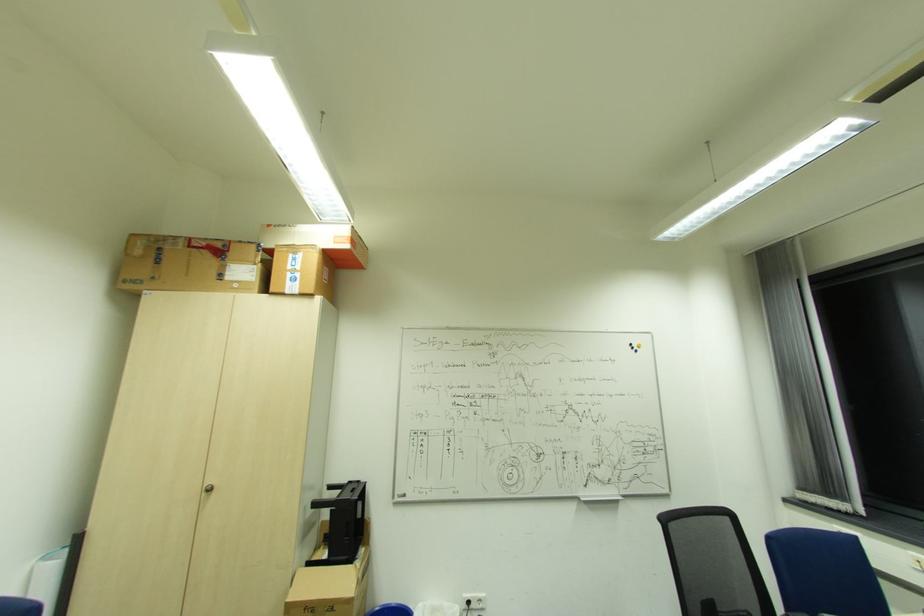
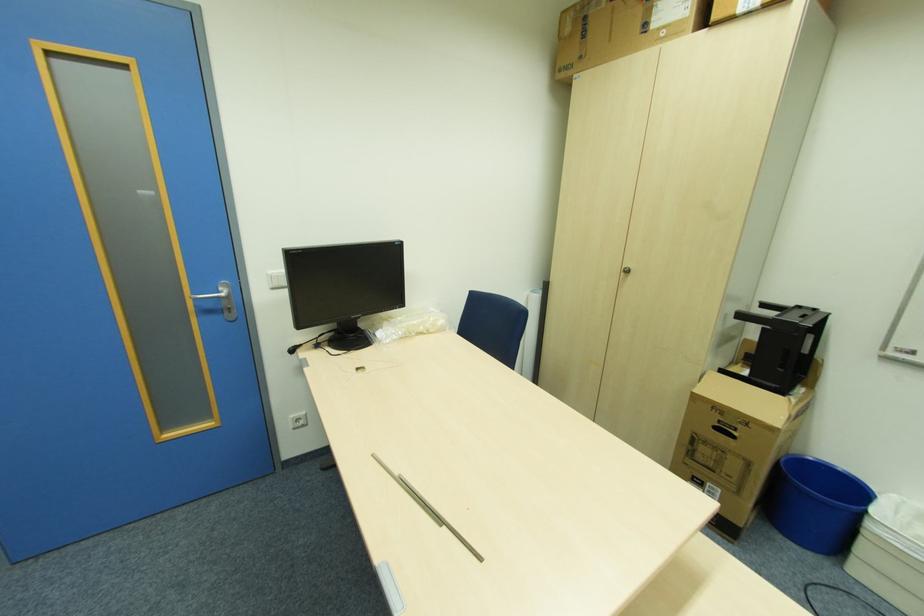
The images are taken continuously from a first-person perspective. In which direction is your viewpoint rotating?

The camera's rotation is toward left-down.